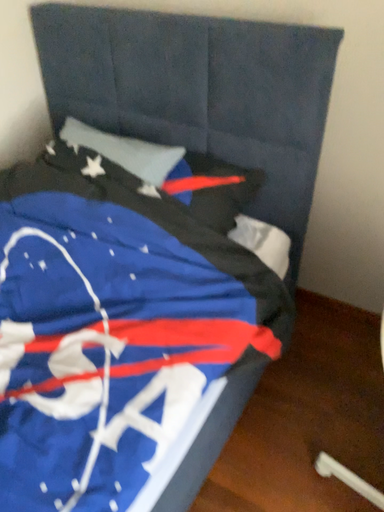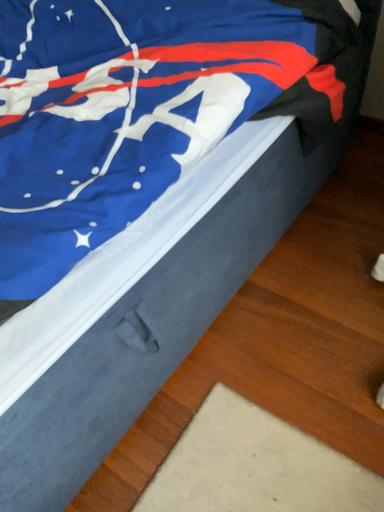
Question: Which way did the camera rotate in the video?

Choices:
 (A) rotated upward
 (B) rotated downward

Answer: (B)